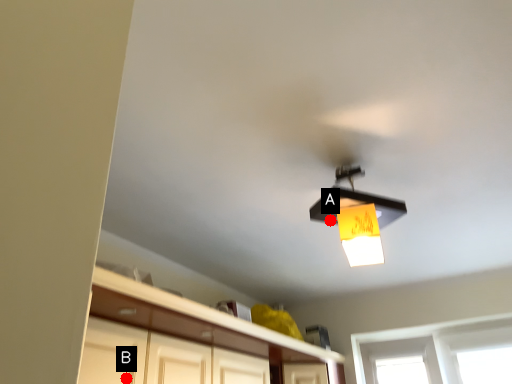
Question: Two points are circled on the image, labeled by A and B beside each circle. Which point is farther from the camera taking this photo?

Choices:
 (A) A is further
 (B) B is further

Answer: (B)